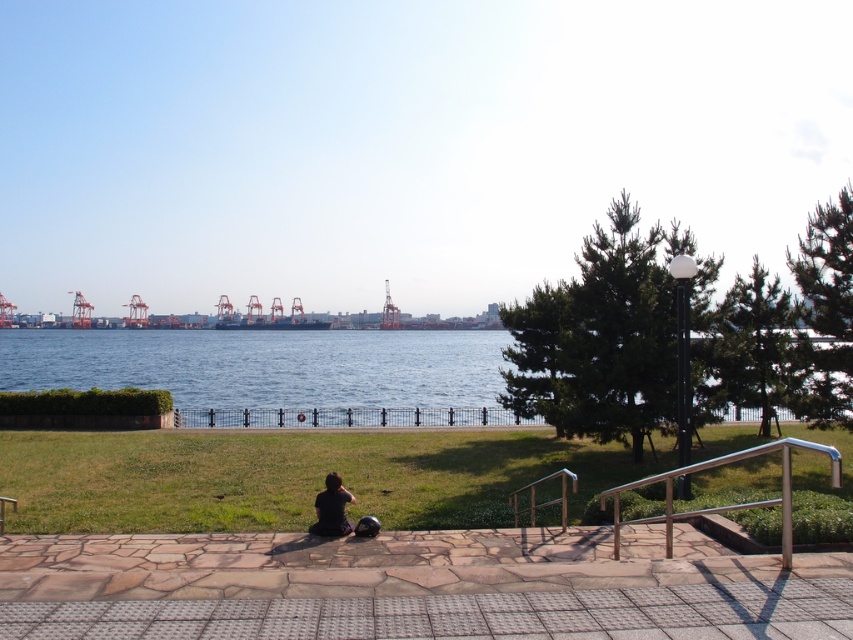
Question: Does black metal fence at center have a greater width compared to black fabric person at center?

Choices:
 (A) yes
 (B) no

Answer: (A)

Question: Is black metal fence at center to the left of black fabric person at center from the viewer's perspective?

Choices:
 (A) yes
 (B) no

Answer: (A)

Question: Which point appears closest to the camera in this image?

Choices:
 (A) (323, 506)
 (B) (338, 424)
 (C) (338, 420)

Answer: (A)

Question: Which object is the closest to the blue water at center?

Choices:
 (A) black fabric person at center
 (B) black metal fence at center

Answer: (B)

Question: Among these points, which one is farthest from the camera?

Choices:
 (A) (331, 518)
 (B) (302, 416)
 (C) (415, 419)

Answer: (C)

Question: In this image, where is blue water at center located relative to black metal fence at center?

Choices:
 (A) right
 (B) left

Answer: (B)